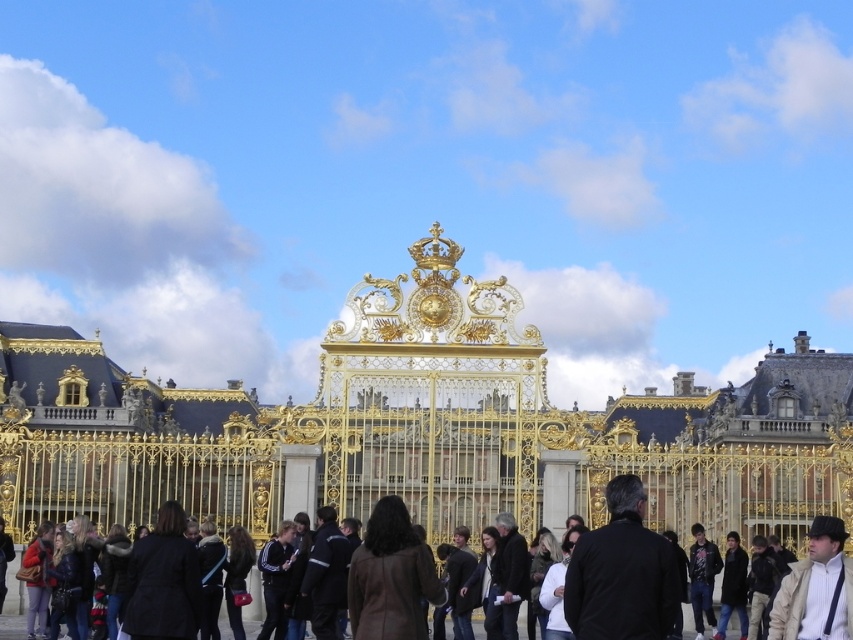
You are standing at the entrance of the palace and want to take a photo of the golden gate. The camera you are using has a maximum zoom range of 100 meters. Is the point at coordinate point (700, 608) within the camera range?

The point at coordinate point (700, 608) is 134.28 meters away from the viewer, which exceeds the camera maximum zoom range of 100 meters. Therefore, the camera cannot capture the point at coordinate point (700, 608).

You are a tour guide standing at the golden gate. You notice two visitors wearing a matte black jacket at center and a shiny brown coat at center. If you want to walk between them, will there be enough space?

The matte black jacket at center is 2.34 meters from the shiny brown coat at center. Therefore, there is sufficient space to walk between them since 2.34 meters is a comfortable distance for a person to pass through.

You are standing in front of the golden gate and want to take a photo of the crowd. Where is the matte black jacket at center located in the image?

The matte black jacket at center is located at the center of the image, at coordinates point (276, 579).